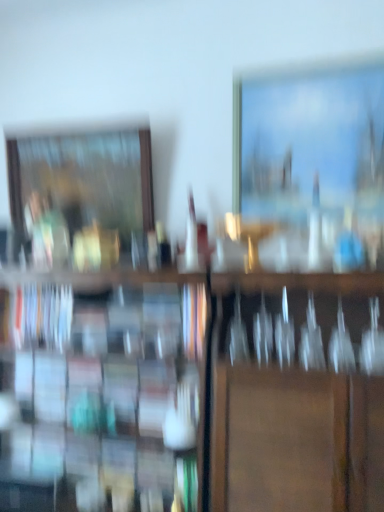
Question: From the image's perspective, is matte wooden picture frame at upper right, which is the 2th picture frame in back-to-front order, under wooden picture frame at left, arranged as the first picture frame when viewed from the back?

Choices:
 (A) no
 (B) yes

Answer: (A)

Question: Does matte wooden picture frame at upper right, the 1th picture frame from the right, have a lesser height compared to wooden picture frame at left, the 1th picture frame in the left-to-right sequence?

Choices:
 (A) yes
 (B) no

Answer: (B)

Question: Is matte wooden picture frame at upper right, the 1th picture frame from the right, positioned far away from wooden picture frame at left, the 2th picture frame viewed from the front?

Choices:
 (A) no
 (B) yes

Answer: (A)

Question: Can you confirm if matte wooden picture frame at upper right, acting as the 1th picture frame starting from the front, is taller than wooden picture frame at left, arranged as the first picture frame when viewed from the back?

Choices:
 (A) no
 (B) yes

Answer: (B)

Question: Considering the relative positions of matte wooden picture frame at upper right, which is the 2th picture frame in back-to-front order, and wooden picture frame at left, the 1th picture frame in the left-to-right sequence, in the image provided, is matte wooden picture frame at upper right, which is the 2th picture frame in back-to-front order, to the right of wooden picture frame at left, the 1th picture frame in the left-to-right sequence, from the viewer's perspective?

Choices:
 (A) yes
 (B) no

Answer: (A)

Question: Is matte wooden picture frame at upper right, marked as the 2th picture frame in a left-to-right arrangement, oriented away from wooden picture frame at left, the 2th picture frame viewed from the front?

Choices:
 (A) yes
 (B) no

Answer: (B)

Question: Considering the relative sizes of wooden picture frame at left, the 2th picture frame viewed from the front, and hardcover book at left in the image provided, is wooden picture frame at left, the 2th picture frame viewed from the front, wider than hardcover book at left?

Choices:
 (A) yes
 (B) no

Answer: (B)

Question: Is wooden picture frame at left, the 2th picture frame viewed from the front, not inside hardcover book at left?

Choices:
 (A) no
 (B) yes

Answer: (B)

Question: Does wooden picture frame at left, arranged as the first picture frame when viewed from the back, appear on the right side of hardcover book at left?

Choices:
 (A) no
 (B) yes

Answer: (B)

Question: Is wooden picture frame at left, the 2th picture frame viewed from the front, behind hardcover book at left?

Choices:
 (A) no
 (B) yes

Answer: (B)

Question: Is wooden picture frame at left, the 1th picture frame in the left-to-right sequence, facing towards hardcover book at left?

Choices:
 (A) yes
 (B) no

Answer: (B)

Question: Considering the relative sizes of wooden picture frame at left, the 2th picture frame viewed from the front, and hardcover book at left in the image provided, is wooden picture frame at left, the 2th picture frame viewed from the front, thinner than hardcover book at left?

Choices:
 (A) yes
 (B) no

Answer: (A)

Question: Is hardcover book at left not near matte wooden picture frame at upper right, acting as the 1th picture frame starting from the front?

Choices:
 (A) yes
 (B) no

Answer: (B)